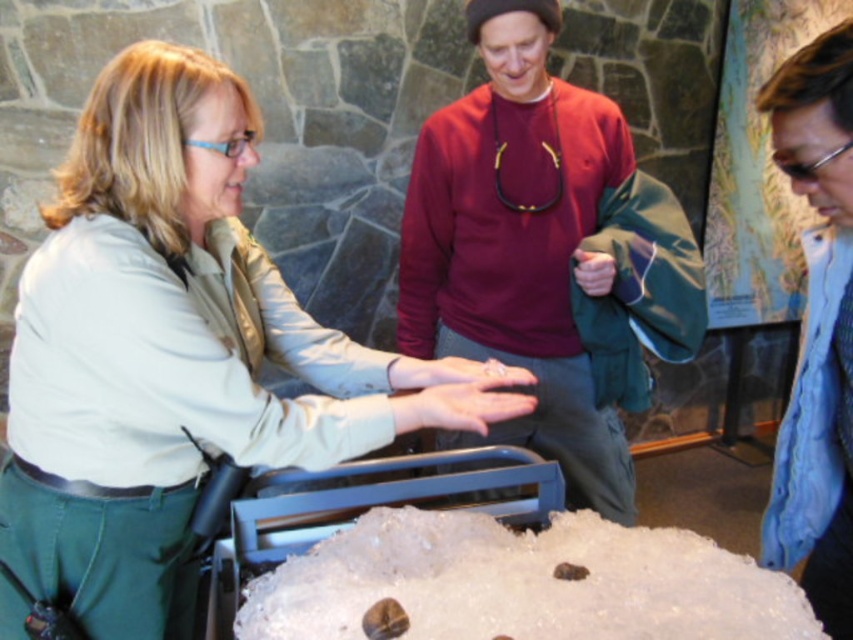
You are standing in the museum and see the matte khaki shirt at center and the maroon sweater at center. Which one is lower in position?

The matte khaki shirt at center is located below the maroon sweater at center, so it is lower in position.

You are a visitor at the museum and want to take a photo of the translucent white ice at center and the blue textured scarf at lower right. Which object should you focus on first if you want to capture both in the same frame without moving your camera?

The translucent white ice at center is positioned on the left side of the blue textured scarf at lower right, so you should focus on the translucent white ice at center first to ensure both objects are in the frame.